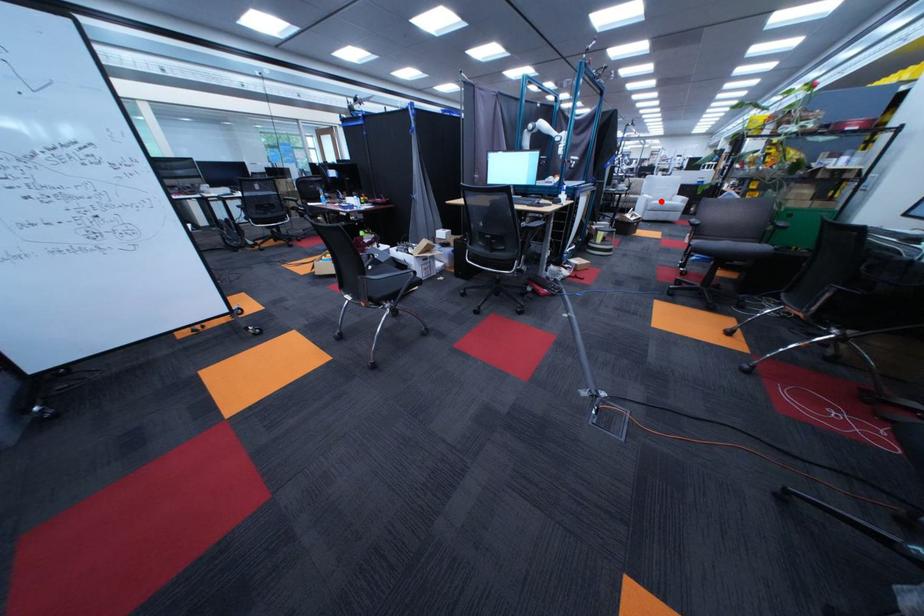
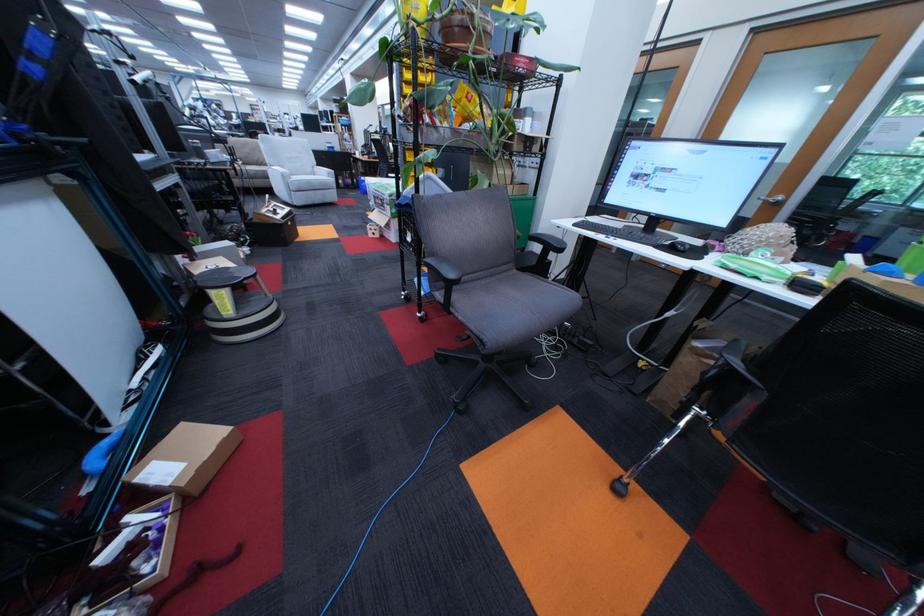
Find the pixel in the second image that matches the highlighted location in the first image.

(298, 177)